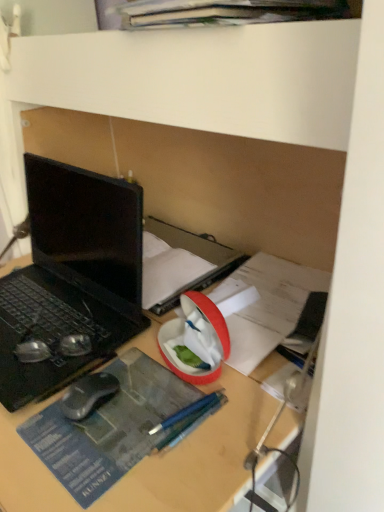
Question: Is there a large distance between metallic blue pencil at center and black rubberized mouse at lower left?

Choices:
 (A) no
 (B) yes

Answer: (A)

Question: Is metallic blue pencil at center facing towards black rubberized mouse at lower left?

Choices:
 (A) no
 (B) yes

Answer: (A)

Question: Is metallic blue pencil at center surrounding black rubberized mouse at lower left?

Choices:
 (A) yes
 (B) no

Answer: (B)

Question: From a real-world perspective, is metallic blue pencil at center physically above black rubberized mouse at lower left?

Choices:
 (A) no
 (B) yes

Answer: (A)

Question: Does metallic blue pencil at center have a smaller size compared to black rubberized mouse at lower left?

Choices:
 (A) no
 (B) yes

Answer: (A)

Question: From the image's perspective, does metallic blue pencil at center appear higher than black rubberized mouse at lower left?

Choices:
 (A) yes
 (B) no

Answer: (B)

Question: Can you confirm if metallic blue pencil at center is smaller than matte black book at center?

Choices:
 (A) yes
 (B) no

Answer: (A)

Question: Is metallic blue pencil at center to the right of matte black book at center from the viewer's perspective?

Choices:
 (A) no
 (B) yes

Answer: (B)

Question: From a real-world perspective, is metallic blue pencil at center on matte black book at center?

Choices:
 (A) no
 (B) yes

Answer: (A)

Question: Is metallic blue pencil at center oriented towards matte black book at center?

Choices:
 (A) yes
 (B) no

Answer: (B)

Question: From the image's perspective, is metallic blue pencil at center on matte black book at center?

Choices:
 (A) no
 (B) yes

Answer: (A)

Question: Considering the relative sizes of metallic blue pencil at center and matte black book at center in the image provided, is metallic blue pencil at center taller than matte black book at center?

Choices:
 (A) yes
 (B) no

Answer: (B)

Question: Can you confirm if matte black book at center is taller than black matte laptop at left?

Choices:
 (A) no
 (B) yes

Answer: (A)